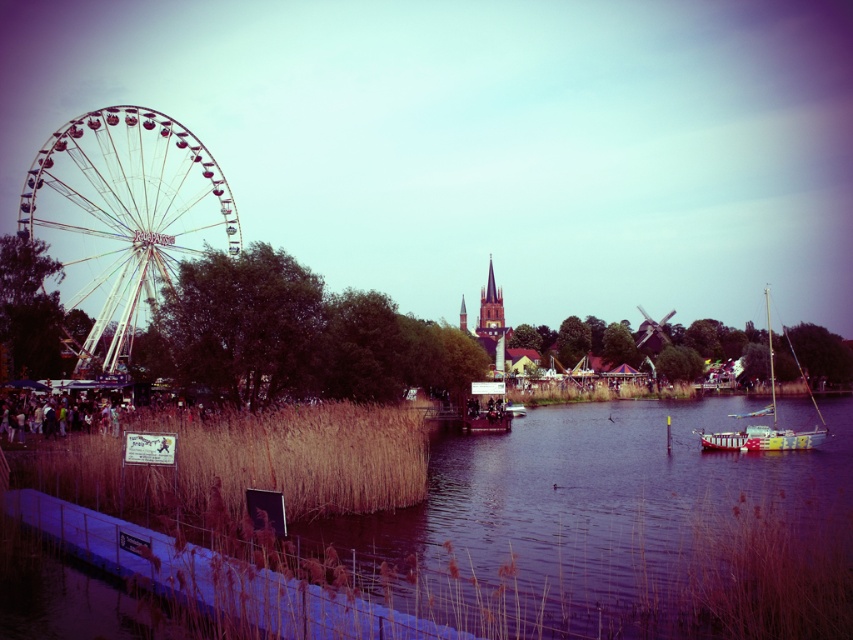
Question: Can you confirm if brown reeds at lower center is positioned to the right of white metallic ferris wheel at left?

Choices:
 (A) no
 (B) yes

Answer: (B)

Question: Can you confirm if brown reeds at lower center is smaller than painted wood sailboat at right?

Choices:
 (A) no
 (B) yes

Answer: (B)

Question: Which of these objects is positioned closest to the white metallic ferris wheel at left?

Choices:
 (A) painted wood sailboat at right
 (B) brown reeds at lower center

Answer: (B)

Question: Which of the following is the closest to the observer?

Choices:
 (A) white metallic ferris wheel at left
 (B) brown reeds at lower center

Answer: (B)

Question: Does brown reeds at lower center lie in front of painted wood sailboat at right?

Choices:
 (A) no
 (B) yes

Answer: (B)

Question: Which object appears farthest from the camera in this image?

Choices:
 (A) painted wood sailboat at right
 (B) white metallic ferris wheel at left
 (C) brown reeds at lower center

Answer: (A)